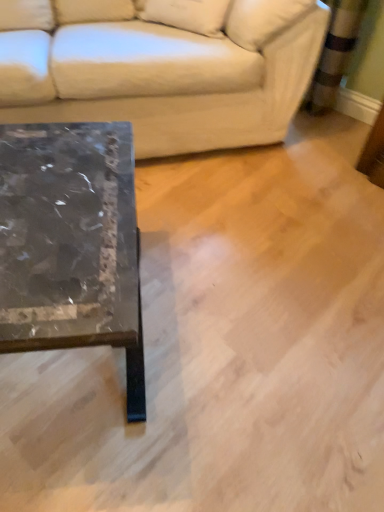
Question: Is beige fabric pillow at upper center with marble/black at left?

Choices:
 (A) no
 (B) yes

Answer: (A)

Question: Does beige fabric pillow at upper center appear on the left side of marble/black at left?

Choices:
 (A) yes
 (B) no

Answer: (B)

Question: Is marble/black at left at the back of beige fabric pillow at upper center?

Choices:
 (A) yes
 (B) no

Answer: (B)

Question: From a real-world perspective, is beige fabric pillow at upper center positioned over marble/black at left based on gravity?

Choices:
 (A) no
 (B) yes

Answer: (B)

Question: Can you confirm if beige fabric pillow at upper center is wider than marble/black at left?

Choices:
 (A) yes
 (B) no

Answer: (B)

Question: From a real-world perspective, is marble/black at left above or below white leather couch at upper left?

Choices:
 (A) above
 (B) below

Answer: (B)

Question: Considering their positions, is marble/black at left located in front of or behind white leather couch at upper left?

Choices:
 (A) behind
 (B) front

Answer: (B)

Question: In terms of width, does marble/black at left look wider or thinner when compared to white leather couch at upper left?

Choices:
 (A) wide
 (B) thin

Answer: (B)

Question: Does point (110, 217) appear closer or farther from the camera than point (140, 137)?

Choices:
 (A) closer
 (B) farther

Answer: (A)

Question: Based on their sizes in the image, would you say beige fabric pillow at upper center is bigger or smaller than white leather couch at upper left?

Choices:
 (A) big
 (B) small

Answer: (B)

Question: Considering their positions, is beige fabric pillow at upper center located in front of or behind white leather couch at upper left?

Choices:
 (A) front
 (B) behind

Answer: (B)

Question: Do you think beige fabric pillow at upper center is within white leather couch at upper left, or outside of it?

Choices:
 (A) outside
 (B) inside

Answer: (B)

Question: From a real-world perspective, is beige fabric pillow at upper center positioned above or below white leather couch at upper left?

Choices:
 (A) below
 (B) above

Answer: (B)

Question: Does point (256, 97) appear closer or farther from the camera than point (72, 210)?

Choices:
 (A) farther
 (B) closer

Answer: (A)

Question: Would you say white leather couch at upper left is inside or outside marble/black at left?

Choices:
 (A) inside
 (B) outside

Answer: (B)